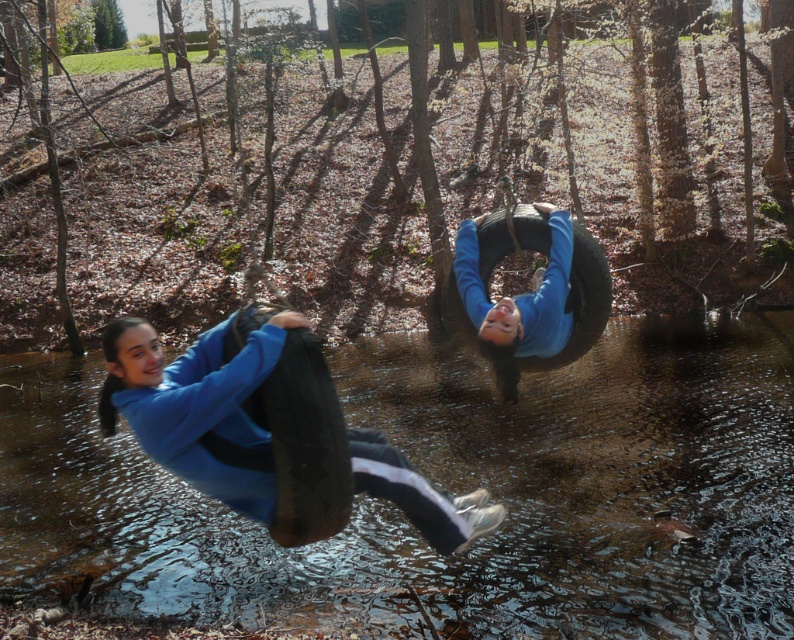
Can you confirm if blue matte jacket at center is thinner than blue matte tire at center?

No, blue matte jacket at center is not thinner than blue matte tire at center.

At what (x,y) coordinates should I click in order to perform the action: click on blue matte jacket at center. Please return your answer as a coordinate pair (x, y). The image size is (794, 640). Looking at the image, I should click on coord(270,429).

Is clear water at center positioned in front of blue matte jacket at center?

No.

Who is higher up, clear water at center or blue matte jacket at center?

Positioned higher is blue matte jacket at center.

Is point (116, 520) farther from camera compared to point (326, 397)?

Yes.

Identify the location of clear water at center. The image size is (794, 640). (451, 492).

Does clear water at center have a lesser width compared to blue matte tire at center?

No, clear water at center is not thinner than blue matte tire at center.

Is clear water at center taller than blue matte tire at center?

Yes, clear water at center is taller than blue matte tire at center.

What do you see at coordinates (451, 492) in the screenshot? I see `clear water at center` at bounding box center [451, 492].

You are a GUI agent. You are given a task and a screenshot of the screen. Output one action in this format:
    pyautogui.click(x=<x>, y=<y>)
    Task: Click on the clear water at center
    This screenshot has height=640, width=794.
    Given the screenshot: What is the action you would take?
    pyautogui.click(x=451, y=492)